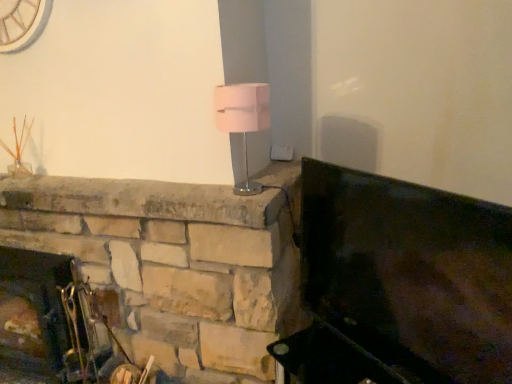
Question: Is pink fabric lampshade at center bigger or smaller than metallic silver fireplace tools at lower left?

Choices:
 (A) big
 (B) small

Answer: (B)

Question: Is pink fabric lampshade at center to the left or to the right of metallic silver fireplace tools at lower left in the image?

Choices:
 (A) right
 (B) left

Answer: (A)

Question: Which object is the farthest from the metallic silver fireplace tools at lower left?

Choices:
 (A) metallic dark green fireplace at right
 (B) pink fabric lampshade at center

Answer: (B)

Question: Based on their relative distances, which object is farther from the pink fabric lampshade at center?

Choices:
 (A) metallic dark green fireplace at right
 (B) metallic silver fireplace tools at lower left

Answer: (B)